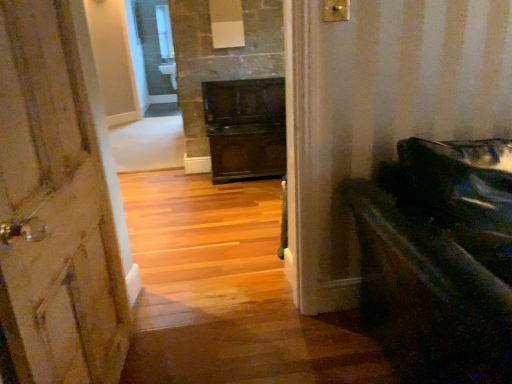
Question: Would you say shiny black piano at right is outside wooden door at left?

Choices:
 (A) no
 (B) yes

Answer: (B)

Question: Does shiny black piano at right have a smaller size compared to wooden door at left?

Choices:
 (A) yes
 (B) no

Answer: (B)

Question: Is shiny black piano at right further to camera compared to wooden door at left?

Choices:
 (A) yes
 (B) no

Answer: (A)

Question: Is shiny black piano at right wider than wooden door at left?

Choices:
 (A) yes
 (B) no

Answer: (A)

Question: Is wooden door at left a part of shiny black piano at right?

Choices:
 (A) yes
 (B) no

Answer: (B)

Question: Considering the relative sizes of shiny black piano at right and wooden door at left in the image provided, is shiny black piano at right shorter than wooden door at left?

Choices:
 (A) no
 (B) yes

Answer: (B)

Question: Could you tell me if wooden door at left is facing shiny black piano at right?

Choices:
 (A) yes
 (B) no

Answer: (A)

Question: Can you confirm if wooden door at left is taller than shiny black piano at right?

Choices:
 (A) yes
 (B) no

Answer: (A)

Question: Is wooden door at left next to shiny black piano at right?

Choices:
 (A) yes
 (B) no

Answer: (B)

Question: Is wooden door at left facing away from shiny black piano at right?

Choices:
 (A) yes
 (B) no

Answer: (B)

Question: Are wooden door at left and shiny black piano at right far apart?

Choices:
 (A) yes
 (B) no

Answer: (A)

Question: Can you confirm if wooden door at left is thinner than shiny black piano at right?

Choices:
 (A) yes
 (B) no

Answer: (A)

Question: Looking at the image, does wooden door at left seem bigger or smaller compared to shiny black piano at right?

Choices:
 (A) big
 (B) small

Answer: (B)